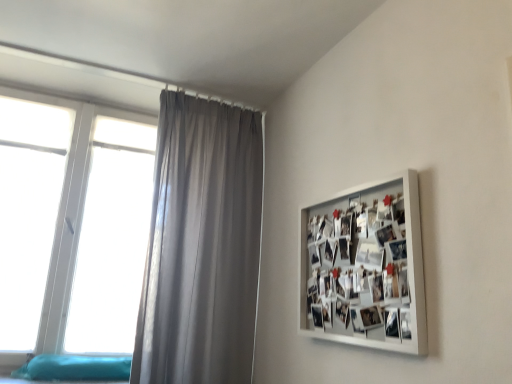
Question: Can you confirm if white matte picture frame at upper right is taller than teal fabric bed at lower left?

Choices:
 (A) yes
 (B) no

Answer: (A)

Question: From the image's perspective, would you say white matte picture frame at upper right is shown under teal fabric bed at lower left?

Choices:
 (A) yes
 (B) no

Answer: (B)

Question: Is white matte picture frame at upper right positioned far away from teal fabric bed at lower left?

Choices:
 (A) yes
 (B) no

Answer: (A)

Question: Is white matte picture frame at upper right positioned in front of teal fabric bed at lower left?

Choices:
 (A) yes
 (B) no

Answer: (A)

Question: Is teal fabric bed at lower left located within white matte picture frame at upper right?

Choices:
 (A) no
 (B) yes

Answer: (A)

Question: From the image's perspective, is white plastic window at left above or below teal fabric bed at lower left?

Choices:
 (A) above
 (B) below

Answer: (A)

Question: Visually, is white plastic window at left positioned to the left or to the right of teal fabric bed at lower left?

Choices:
 (A) right
 (B) left

Answer: (B)

Question: Does point (26, 294) appear closer or farther from the camera than point (74, 370)?

Choices:
 (A) closer
 (B) farther

Answer: (B)

Question: Considering the positions of white plastic window at left and teal fabric bed at lower left in the image, is white plastic window at left bigger or smaller than teal fabric bed at lower left?

Choices:
 (A) big
 (B) small

Answer: (A)

Question: From their relative heights in the image, would you say teal fabric bed at lower left is taller or shorter than white plastic window at left?

Choices:
 (A) short
 (B) tall

Answer: (A)

Question: Is teal fabric bed at lower left in front of or behind white plastic window at left in the image?

Choices:
 (A) front
 (B) behind

Answer: (A)

Question: Is teal fabric bed at lower left inside the boundaries of white plastic window at left, or outside?

Choices:
 (A) inside
 (B) outside

Answer: (B)

Question: From a real-world perspective, is teal fabric bed at lower left above or below white plastic window at left?

Choices:
 (A) below
 (B) above

Answer: (A)

Question: In terms of width, does white matte picture frame at upper right look wider or thinner when compared to teal fabric bed at lower left?

Choices:
 (A) thin
 (B) wide

Answer: (A)

Question: From their relative heights in the image, would you say white matte picture frame at upper right is taller or shorter than teal fabric bed at lower left?

Choices:
 (A) tall
 (B) short

Answer: (A)